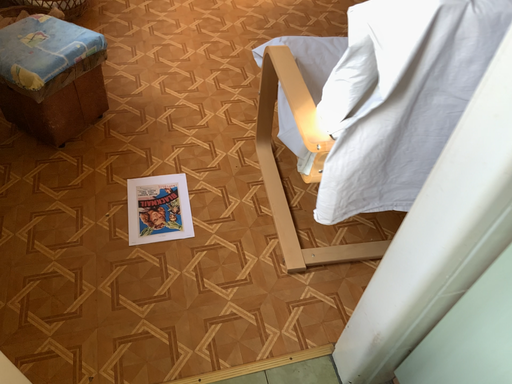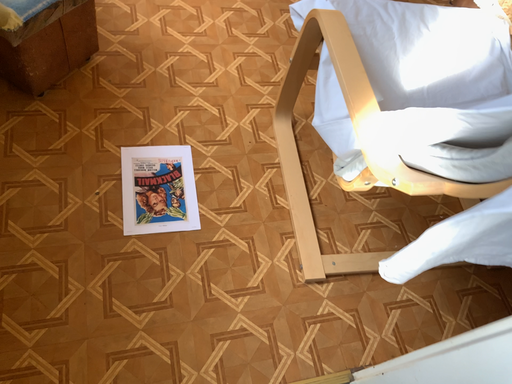
Question: Which way did the camera rotate in the video?

Choices:
 (A) rotated downward
 (B) rotated upward

Answer: (A)